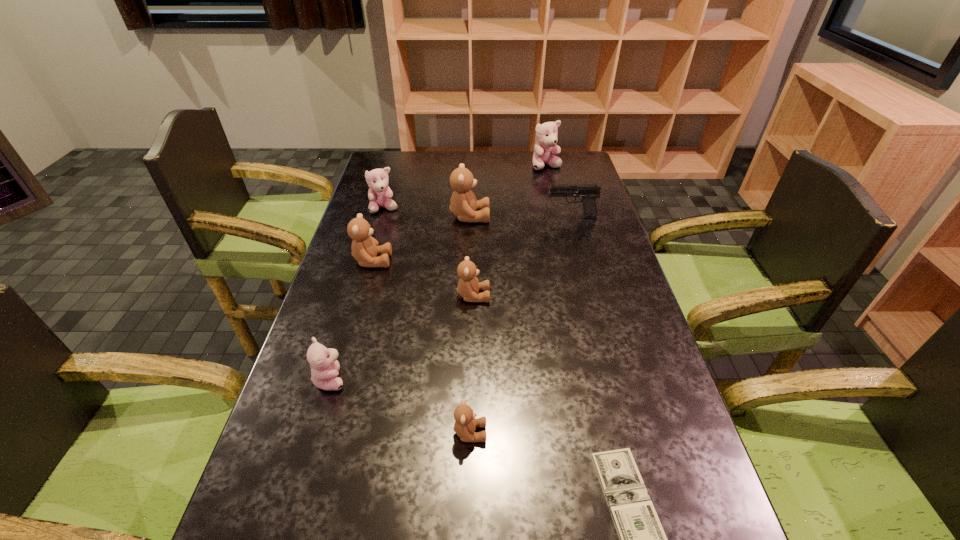
Find the location of `pink teddy bear that is the closest to the sixth farthest object`. pink teddy bear that is the closest to the sixth farthest object is located at coordinates (323, 362).

I want to click on brown teddy bear that is the fourth closest to the nearest pink teddy bear, so click(463, 204).

I want to click on brown teddy bear that stands as the third closest to the biggest brown teddy bear, so click(x=465, y=424).

Locate an element on the screen. free region that satisfies the following two spatial constraints: 1. at the face of the rightmost teddy bear; 2. on the face of the third nearest brown teddy bear is located at coordinates (568, 261).

This screenshot has width=960, height=540. What are the coordinates of `free point that satisfies the following two spatial constraints: 1. at the face of the second biggest pink teddy bear; 2. at the face of the second nearest teddy bear` in the screenshot? It's located at (335, 379).